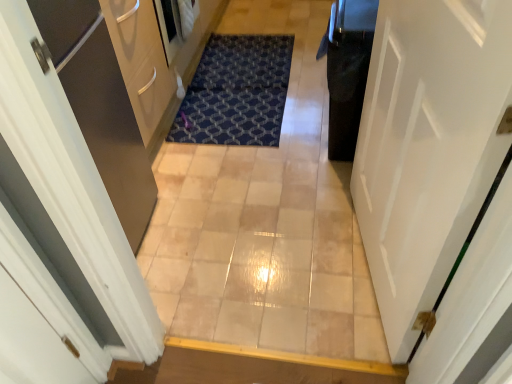
This screenshot has height=384, width=512. I want to click on free space in front of black glossy trash can at right, so click(318, 185).